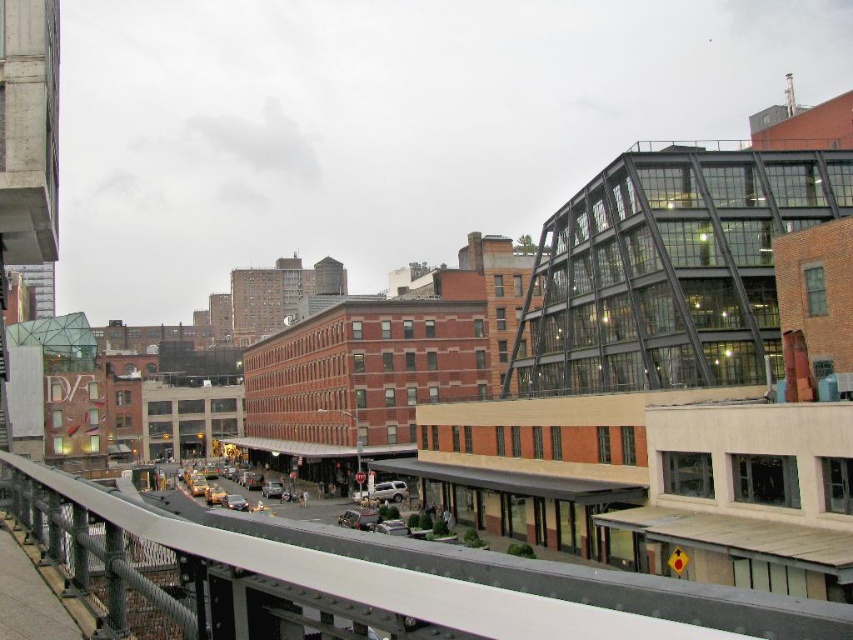
Question: Which point is closer to the camera?

Choices:
 (A) 271,493
 (B) 204,500
 (C) 459,561

Answer: (C)

Question: Which point is closer to the camera?

Choices:
 (A) (263, 490)
 (B) (386, 499)

Answer: (B)

Question: From the image, what is the correct spatial relationship of metallic gray rail at center in relation to yellow rubber car at center?

Choices:
 (A) above
 (B) below

Answer: (A)

Question: Which object is positioned closest to the silver metallic suv at center?

Choices:
 (A) yellow rubber car at center
 (B) shiny silver car at center
 (C) metallic silver car at center

Answer: (C)

Question: Is silver metallic suv at center to the right of silver metallic car at lower center from the viewer's perspective?

Choices:
 (A) yes
 (B) no

Answer: (A)

Question: Observing the image, what is the correct spatial positioning of shiny silver car at center in reference to yellow rubber car at center?

Choices:
 (A) above
 (B) below

Answer: (A)